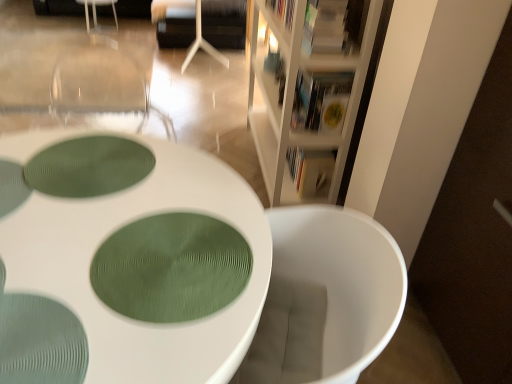
Identify the location of free location to the left of green textured oval at center, marked as the 1th oval in a front-to-back arrangement. The image size is (512, 384). (58, 241).